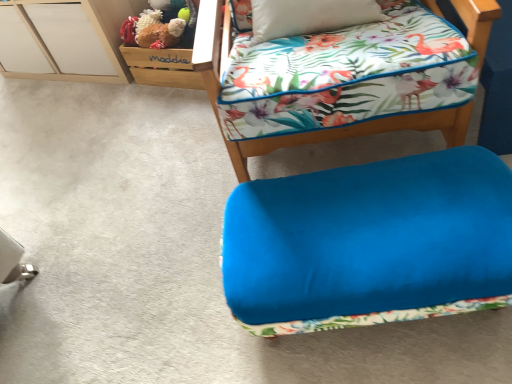
What are the coordinates of `vacant region above velvet blue ottoman at lower right, the 2th furniture viewed from the top (from a real-world perspective)` in the screenshot? It's located at (378, 212).